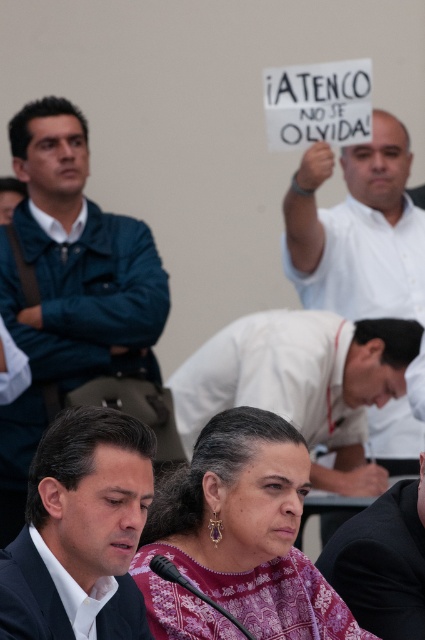
You are organizing a photo shoot and need to adjust the lighting to ensure both the matte black man at lower left and the white matte shirt at upper right are properly illuminated. Considering their sizes in the frame, which object might require more light to appear correctly exposed?

The matte black man at lower left occupies less space than the white matte shirt at upper right. Since smaller objects may require more focused lighting to ensure proper exposure, the matte black man at lower left might need more light to appear correctly exposed.

You are a photographer setting up for a group photo. You need to position two subjects so that they are exactly 36 inches apart. The subjects must be the dark blue jacket at left and the white matte shirt at upper right. Can you achieve this spacing based on the current arrangement?

The distance between the dark blue jacket at left and the white matte shirt at upper right is currently 36.96 inches, which is slightly more than the required 36 inches. To achieve exactly 36 inches, the subjects would need to move closer by approximately 0.96 inches.

You are organizing a photo shoot and need to ensure that the purple printed blouse at center and the white matte shirt at upper right are both visible in the frame. Based on their sizes in the image, which one might require more careful framing to ensure it doesn not get cropped out?

The purple printed blouse at center occupies less space than the white matte shirt at upper right, so it might require more careful framing to ensure it doesn not get cropped out.